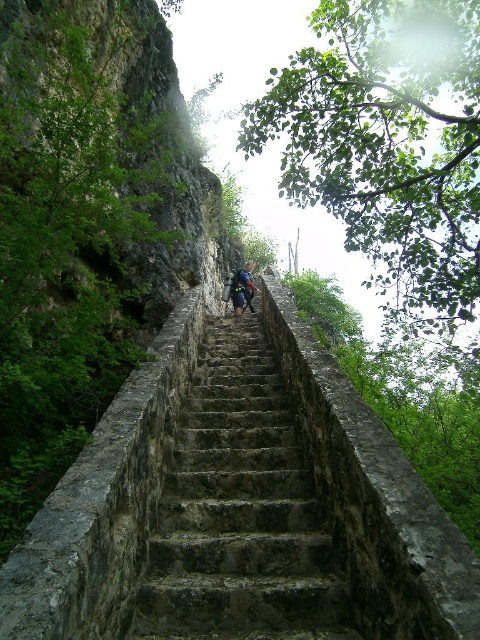
Question: Which object is farther from the camera taking this photo?

Choices:
 (A) blue fabric backpack at center
 (B) rusty stone staircase at center

Answer: (A)

Question: Estimate the real-world distances between objects in this image. Which object is farther from the blue fabric backpack at center?

Choices:
 (A) rusty stone stairs at center
 (B) rusty stone staircase at center

Answer: (B)

Question: Which is farther from the rusty stone staircase at center?

Choices:
 (A) blue fabric backpack at center
 (B) rusty stone stairs at center

Answer: (A)

Question: Can you confirm if rusty stone staircase at center is positioned below rusty stone stairs at center?

Choices:
 (A) no
 (B) yes

Answer: (A)

Question: Does rusty stone staircase at center have a smaller size compared to rusty stone stairs at center?

Choices:
 (A) no
 (B) yes

Answer: (B)

Question: From the image, what is the correct spatial relationship of rusty stone stairs at center in relation to blue fabric backpack at center?

Choices:
 (A) right
 (B) left

Answer: (B)